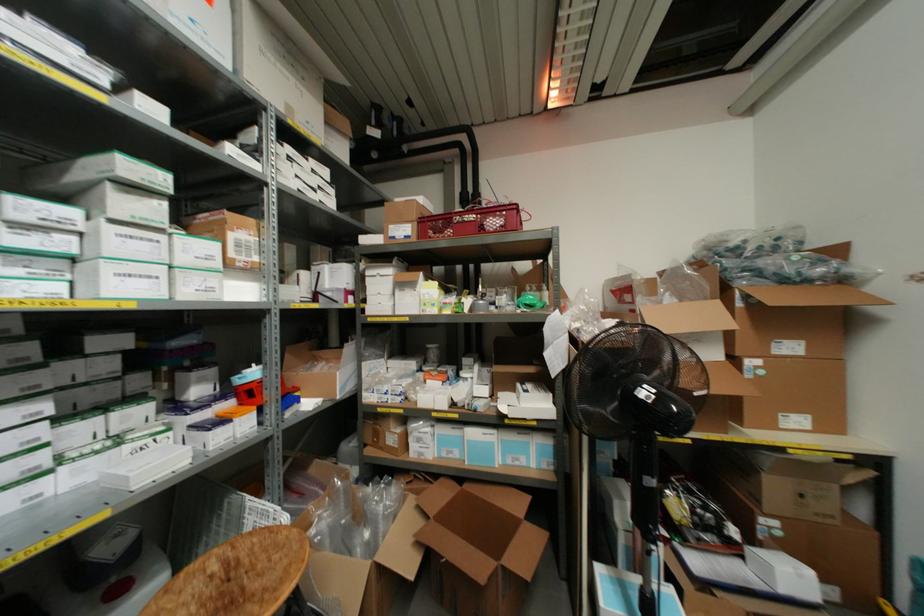
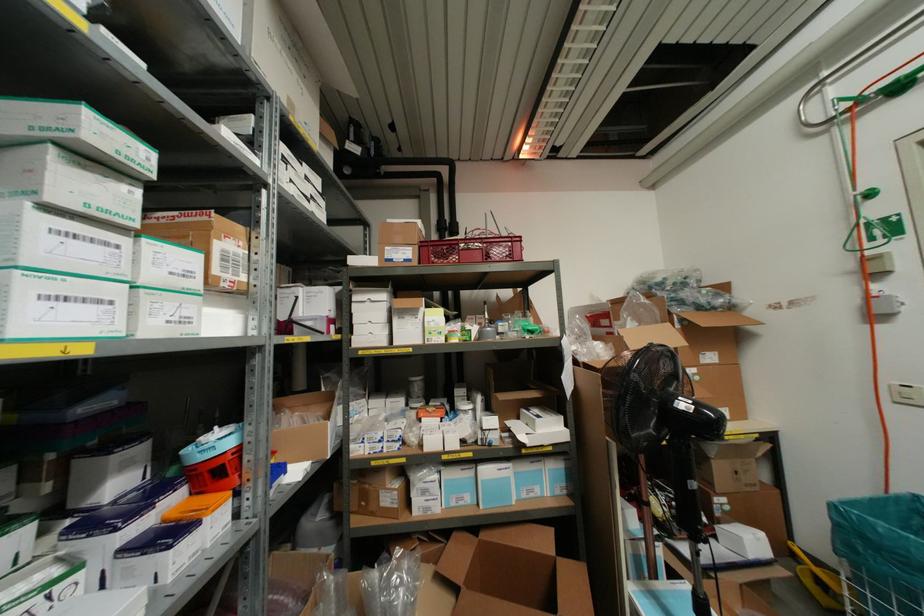
Where in the second image is the point corresponding to point 252,363 from the first image?

(214, 427)